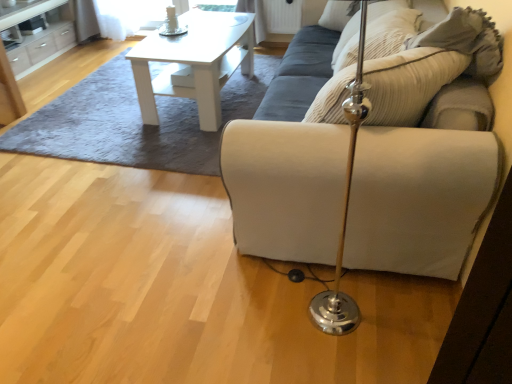
Question: Is beige fabric couch at center turned away from beige corduroy pillow at upper right, placed as the second pillow when sorted from front to back?

Choices:
 (A) no
 (B) yes

Answer: (B)

Question: Is beige fabric couch at center at the right side of beige corduroy pillow at upper right, placed as the second pillow when sorted from front to back?

Choices:
 (A) yes
 (B) no

Answer: (B)

Question: Can you confirm if beige fabric couch at center is thinner than beige corduroy pillow at upper right, placed as the second pillow when sorted from front to back?

Choices:
 (A) yes
 (B) no

Answer: (B)

Question: Is beige corduroy pillow at upper right, placed as the second pillow when sorted from front to back, inside beige fabric couch at center?

Choices:
 (A) no
 (B) yes

Answer: (B)

Question: Is the position of beige fabric couch at center less distant than that of beige corduroy pillow at upper right, the 1th pillow in the back-to-front sequence?

Choices:
 (A) yes
 (B) no

Answer: (A)

Question: Is beige fabric couch at center facing towards beige corduroy pillow at upper right, the 1th pillow in the back-to-front sequence?

Choices:
 (A) yes
 (B) no

Answer: (A)

Question: Considering the relative sizes of white matte table at upper center and beige fabric couch at center in the image provided, is white matte table at upper center shorter than beige fabric couch at center?

Choices:
 (A) yes
 (B) no

Answer: (A)

Question: Can you confirm if white matte table at upper center is positioned to the right of beige fabric couch at center?

Choices:
 (A) no
 (B) yes

Answer: (A)

Question: Is white matte table at upper center surrounding beige fabric couch at center?

Choices:
 (A) yes
 (B) no

Answer: (B)

Question: Can you confirm if white matte table at upper center is thinner than beige fabric couch at center?

Choices:
 (A) yes
 (B) no

Answer: (A)

Question: Is white matte table at upper center aimed at beige fabric couch at center?

Choices:
 (A) yes
 (B) no

Answer: (B)

Question: From a real-world perspective, is white matte table at upper center beneath beige fabric couch at center?

Choices:
 (A) no
 (B) yes

Answer: (B)

Question: Is white matte table at upper center completely or partially outside of suede beige pillow at upper right, arranged as the 1th pillow when viewed from the front?

Choices:
 (A) no
 (B) yes

Answer: (B)